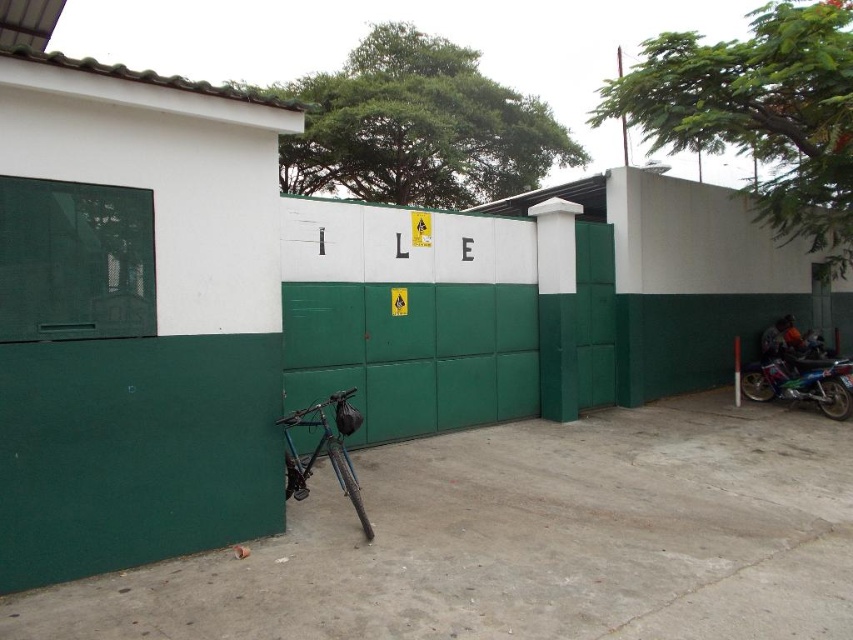
Identify the location of shiny metallic bicycle at center. (325, 451).

The height and width of the screenshot is (640, 853). In order to click on shiny metallic bicycle at center in this screenshot , I will do `click(325, 451)`.

This screenshot has width=853, height=640. In order to click on shiny metallic bicycle at center in this screenshot , I will do `click(325, 451)`.